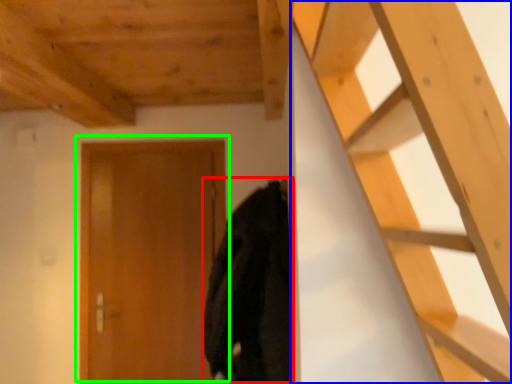
Question: Based on their relative distances, which object is nearer to cloak (highlighted by a red box)? Choose from ladder (highlighted by a blue box) and door (highlighted by a green box).

Choices:
 (A) ladder
 (B) door

Answer: (B)